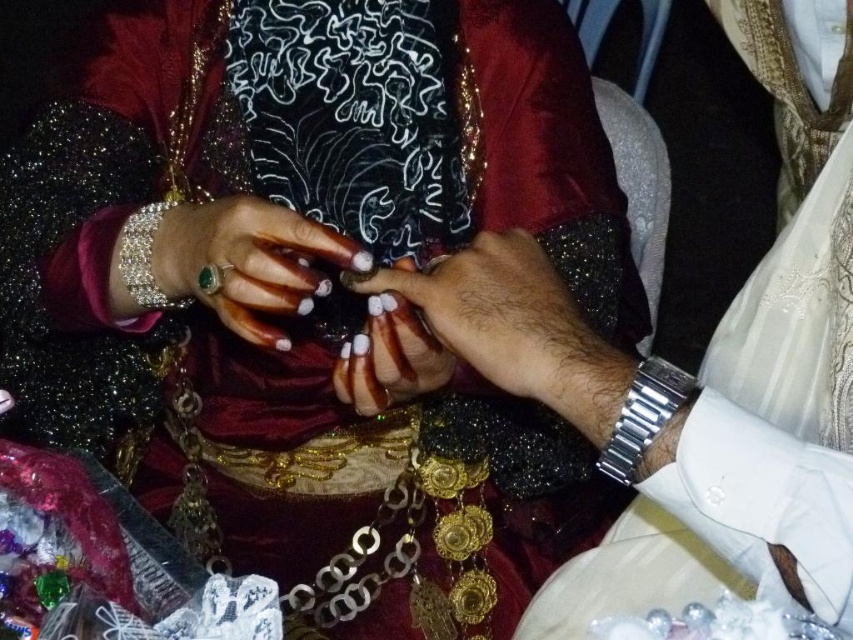
The image size is (853, 640). I want to click on silver metallic watch at lower right, so click(643, 417).

Who is positioned more to the right, silver metallic watch at lower right or silver metallic bracelet at left?

From the viewer's perspective, silver metallic watch at lower right appears more on the right side.

The image size is (853, 640). In order to click on silver metallic watch at lower right in this screenshot , I will do `click(643, 417)`.

Where is `silver metallic watch at lower right`? This screenshot has height=640, width=853. silver metallic watch at lower right is located at coordinates (643, 417).

Is matte gold ring at center above silver metallic watch at lower right?

Yes, matte gold ring at center is above silver metallic watch at lower right.

Is matte gold ring at center shorter than silver metallic watch at lower right?

No.

You are a GUI agent. You are given a task and a screenshot of the screen. Output one action in this format:
    pyautogui.click(x=<x>, y=<y>)
    Task: Click on the matte gold ring at center
    The image size is (853, 640).
    Given the screenshot: What is the action you would take?
    pyautogui.click(x=247, y=260)

Does point (387, 280) come farther from viewer compared to point (231, 284)?

Yes, it is.

From the picture: Is white matte nail polish at center wider than matte gold ring at center?

Correct, the width of white matte nail polish at center exceeds that of matte gold ring at center.

Who is more distant from viewer, (430, 294) or (312, 228)?

Point (312, 228)

At what (x,y) coordinates should I click in order to perform the action: click on white matte nail polish at center. Please return your answer as a coordinate pair (x, y). Image resolution: width=853 pixels, height=640 pixels. Looking at the image, I should click on (490, 320).